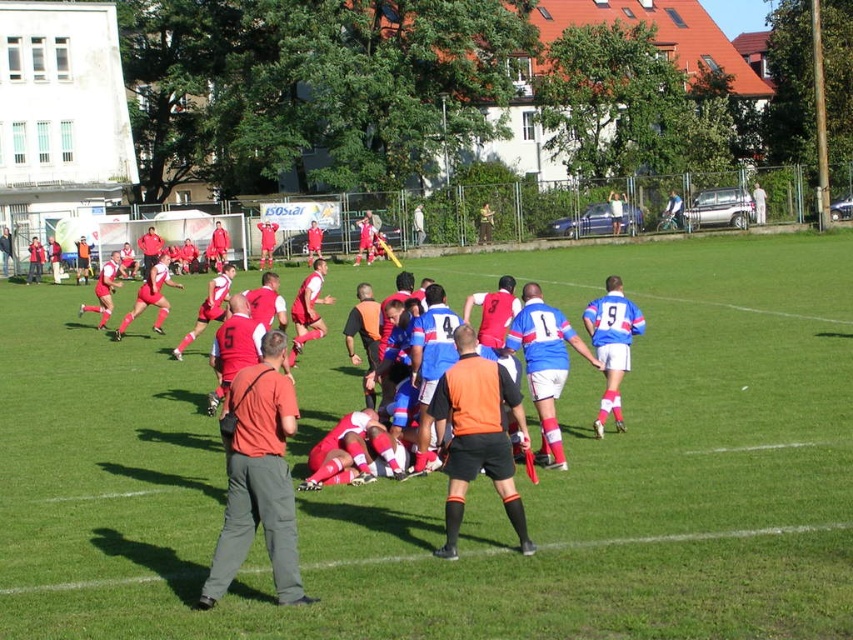
Question: Is orange shirt at center in front of orange mesh vest at center?

Choices:
 (A) no
 (B) yes

Answer: (B)

Question: Is green grass football field at center positioned in front of orange mesh vest at center?

Choices:
 (A) yes
 (B) no

Answer: (A)

Question: Estimate the real-world distances between objects in this image. Which object is closer to the green grass football field at center?

Choices:
 (A) blue fabric jersey at center
 (B) orange mesh vest at center
 (C) orange shirt at center

Answer: (C)

Question: Does orange shirt at center appear over orange mesh vest at center?

Choices:
 (A) no
 (B) yes

Answer: (A)

Question: Considering the real-world distances, which object is closest to the orange shirt at center?

Choices:
 (A) blue fabric jersey at center
 (B) green grass football field at center

Answer: (B)

Question: Which of the following is the closest to the observer?

Choices:
 (A) orange shirt at center
 (B) green grass football field at center
 (C) orange mesh vest at center

Answer: (B)